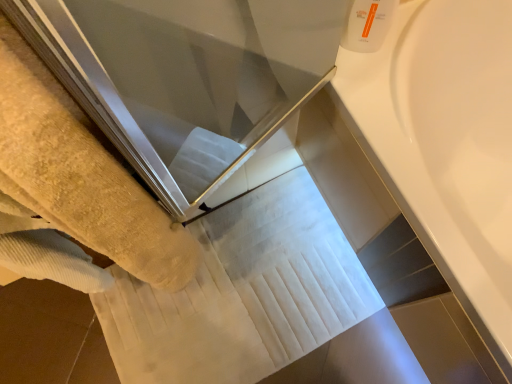
Question: From the image's perspective, is white plastic bottle at upper right located above yellow terry towel at left?

Choices:
 (A) no
 (B) yes

Answer: (B)

Question: From a real-world perspective, is white plastic bottle at upper right over yellow terry towel at left?

Choices:
 (A) no
 (B) yes

Answer: (B)

Question: Considering the relative sizes of white plastic bottle at upper right and yellow terry towel at left in the image provided, is white plastic bottle at upper right wider than yellow terry towel at left?

Choices:
 (A) yes
 (B) no

Answer: (B)

Question: Are white plastic bottle at upper right and yellow terry towel at left far apart?

Choices:
 (A) no
 (B) yes

Answer: (A)

Question: Does white plastic bottle at upper right turn towards yellow terry towel at left?

Choices:
 (A) no
 (B) yes

Answer: (A)

Question: Is white plastic bottle at upper right facing away from yellow terry towel at left?

Choices:
 (A) yes
 (B) no

Answer: (B)

Question: Can you confirm if white plastic bottle at upper right is shorter than white glossy bathtub at upper right?

Choices:
 (A) no
 (B) yes

Answer: (B)

Question: Is white plastic bottle at upper right turned away from white glossy bathtub at upper right?

Choices:
 (A) yes
 (B) no

Answer: (B)

Question: Considering the relative positions of white plastic bottle at upper right and white glossy bathtub at upper right in the image provided, is white plastic bottle at upper right in front of white glossy bathtub at upper right?

Choices:
 (A) no
 (B) yes

Answer: (A)

Question: Are white plastic bottle at upper right and white glossy bathtub at upper right far apart?

Choices:
 (A) no
 (B) yes

Answer: (A)

Question: From a real-world perspective, is white plastic bottle at upper right physically above white glossy bathtub at upper right?

Choices:
 (A) no
 (B) yes

Answer: (B)

Question: Is white plastic bottle at upper right smaller than white glossy bathtub at upper right?

Choices:
 (A) no
 (B) yes

Answer: (B)

Question: Can you confirm if yellow terry towel at left is bigger than white plastic bottle at upper right?

Choices:
 (A) no
 (B) yes

Answer: (B)